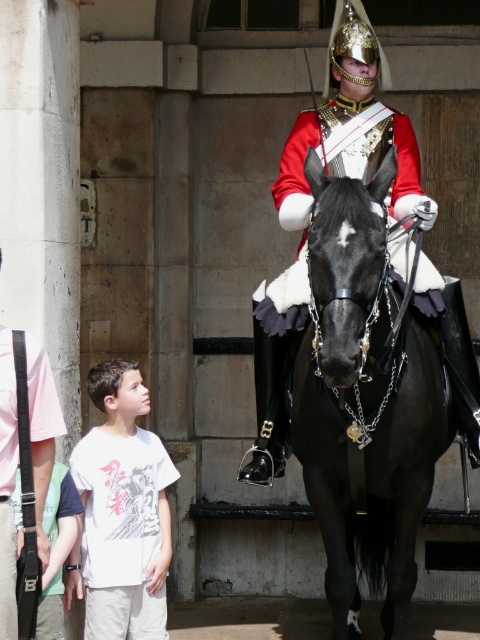
Based on the photo, you are a photographer trying to capture the perfect shot of the black glossy horse at center. Given that your camera has a focal length of 50mm and you are positioned 10 meters away from the horse, can you estimate the approximate size of the horse in millimeters on the camera sensor?

The black glossy horse at center is positioned at point (364, 403) in the image. Using the formula for sensor size calculation, the horse would occupy approximately 10.6mm on the camera sensor.

You are standing at the position of the mounted soldier. You want to throw a small ball to the boy who is at point (97, 444). However, there is an obstacle at point (410, 189). Will the ball pass over the obstacle if you aim directly at the boy?

Point (410, 189) is in front of point (97, 444). Therefore, the obstacle at point (410, 189) will block the path to the boy at point (97, 444). The ball will not pass over the obstacle if you aim directly at the boy.

You are standing at a distance of 10 meters from the mounted soldier and the boy. You want to take a photo of them both. Is the point at coordinate point [404,124] close enough to ensure both the mounted soldier and the boy are in the frame?

The point at coordinate point [404,124] is 9.97 meters away from the viewer, which is within the 10 meters distance you mentioned. Therefore, both the mounted soldier and the boy should be in the frame.